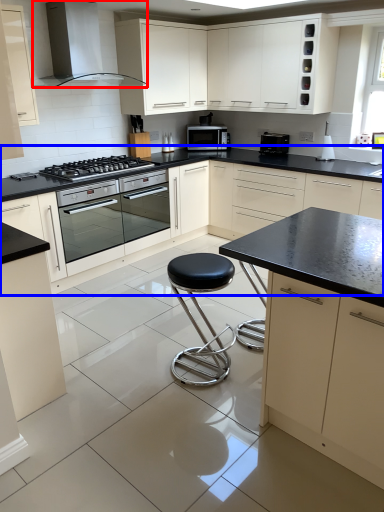
Question: Which of the following is the closest to the observer, home appliance (highlighted by a red box) or cabinetry (highlighted by a blue box)?

Choices:
 (A) home appliance
 (B) cabinetry

Answer: (A)